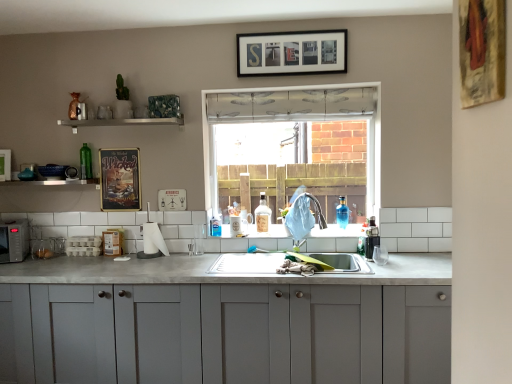
The image size is (512, 384). In order to click on metallic poster at upper left, marked as the 3th picture frame in a right-to-left arrangement in this screenshot , I will do `click(120, 179)`.

The image size is (512, 384). What do you see at coordinates (280, 334) in the screenshot?
I see `matte gray cabinets at center` at bounding box center [280, 334].

Describe the element at coordinates (342, 213) in the screenshot. The height and width of the screenshot is (384, 512). I see `blue glass bottle at sink, which appears as the third bottle when viewed from the left` at that location.

What is the approximate height of black matte microwave at left?

The height of black matte microwave at left is 10.27 inches.

Identify the location of metallic poster at upper left, the 1th picture frame positioned from the bottom. This screenshot has height=384, width=512. (120, 179).

From the picture: Measure the distance between black matte microwave at left and clear glass bottle at sink, the 2th bottle in the right-to-left sequence.

They are 5.21 feet apart.

Is black matte microwave at left far from clear glass bottle at sink, the second bottle in the left-to-right sequence?

Yes, black matte microwave at left and clear glass bottle at sink, the second bottle in the left-to-right sequence, are quite far apart.

From the image's perspective, would you say black matte microwave at left is shown under clear glass bottle at sink, the 2th bottle in the right-to-left sequence?

Indeed, from the image's perspective, black matte microwave at left is shown beneath clear glass bottle at sink, the 2th bottle in the right-to-left sequence.

Which is nearer, (11, 225) or (255, 215)?

Point (11, 225) is positioned closer to the camera compared to point (255, 215).

From a real-world perspective, is white tile at lower center, which appears as the first window sill when viewed from the left, physically below wooden framed artwork at upper right, which is the second picture frame from top to bottom?

Indeed, from a real-world perspective, white tile at lower center, which appears as the first window sill when viewed from the left, is positioned beneath wooden framed artwork at upper right, which is the second picture frame from top to bottom.

Which of these two, white tile at lower center, which appears as the first window sill when viewed from the left, or wooden framed artwork at upper right, placed as the 3th picture frame when sorted from left to right, is wider?

Wider between the two is white tile at lower center, which appears as the first window sill when viewed from the left.

Is white tile at lower center, which is counted as the first window sill, starting from the bottom, bigger than wooden framed artwork at upper right, arranged as the 3th picture frame when viewed from the back?

Yes.

You are a GUI agent. You are given a task and a screenshot of the screen. Output one action in this format:
    pyautogui.click(x=<x>, y=<y>)
    Task: Click on the 2nd window sill to the left when counting from the wooden framed artwork at upper right, arranged as the 3th picture frame when viewed from the back
    This screenshot has height=384, width=512.
    Given the screenshot: What is the action you would take?
    pyautogui.click(x=51, y=182)

From a real-world perspective, between black matte microwave at left and wooden framed artwork at upper right, which appears as the first picture frame when viewed from the right, who is vertically higher?

In real-world perspective, wooden framed artwork at upper right, which appears as the first picture frame when viewed from the right, is above.

Does black matte microwave at left contain wooden framed artwork at upper right, the second picture frame from the bottom?

No.

Image resolution: width=512 pixels, height=384 pixels. There is a black matte microwave at left. Find the location of `the 2nd picture frame above it (from the image's perspective)`. the 2nd picture frame above it (from the image's perspective) is located at coordinates (482, 51).

Is blue glass bottle at sink, which appears as the third bottle when viewed from the left, oriented away from white tile at lower center, which is the 2th window sill from right to left?

No, blue glass bottle at sink, which appears as the third bottle when viewed from the left, is not facing the opposite direction of white tile at lower center, which is the 2th window sill from right to left.

From the white tile at lower center, which is counted as the first window sill, starting from the bottom, count 3rd bottle to the right and point to it. Please provide its 2D coordinates.

[(342, 213)]

In the image, is blue glass bottle at sink, which appears as the third bottle when viewed from the left, on the left side or the right side of white tile at lower center, which is the 2th window sill from right to left?

From the image, it's evident that blue glass bottle at sink, which appears as the third bottle when viewed from the left, is to the right of white tile at lower center, which is the 2th window sill from right to left.

From a real-world perspective, between white glossy shelf at upper center, which is the first window sill in right-to-left order, and black matte picture frame at upper center, positioned as the 2th picture frame in back-to-front order, who is vertically higher?

black matte picture frame at upper center, positioned as the 2th picture frame in back-to-front order, from a real-world perspective.

Is white glossy shelf at upper center, which is counted as the 2th window sill, starting from the bottom, bigger than black matte picture frame at upper center, positioned as the 2th picture frame in back-to-front order?

Incorrect, white glossy shelf at upper center, which is counted as the 2th window sill, starting from the bottom, is not larger than black matte picture frame at upper center, positioned as the 2th picture frame in back-to-front order.

This screenshot has width=512, height=384. What are the coordinates of `window sill that is the 1st one when counting backward from the black matte picture frame at upper center, which appears as the 3th picture frame when ordered from the bottom` in the screenshot? It's located at (122, 122).

Can you confirm if white glossy shelf at upper center, which is counted as the 2th window sill, starting from the bottom, is taller than black matte picture frame at upper center, which appears as the 3th picture frame when ordered from the bottom?

Incorrect, the height of white glossy shelf at upper center, which is counted as the 2th window sill, starting from the bottom, is not larger of that of black matte picture frame at upper center, which appears as the 3th picture frame when ordered from the bottom.

Which object is further away from the camera taking this photo, white glossy shelf at upper center, which is counted as the 2th window sill, starting from the bottom, or white tile at lower center, which is the 2th window sill from right to left?

Positioned behind is white tile at lower center, which is the 2th window sill from right to left.

The height and width of the screenshot is (384, 512). Identify the location of window sill below the white glossy shelf at upper center, which ranks as the first window sill in top-to-bottom order (from a real-world perspective). (51, 182).

From a real-world perspective, is white glossy shelf at upper center, which ranks as the first window sill in top-to-bottom order, on white tile at lower center, which ranks as the 2th window sill in top-to-bottom order?

Yes, from a real-world perspective, white glossy shelf at upper center, which ranks as the first window sill in top-to-bottom order, is over white tile at lower center, which ranks as the 2th window sill in top-to-bottom order

Is white glossy shelf at upper center, positioned as the 2th window sill in left-to-right order, taller or shorter than white tile at lower center, which appears as the first window sill when viewed from the left?

In the image, white glossy shelf at upper center, positioned as the 2th window sill in left-to-right order, appears to be shorter than white tile at lower center, which appears as the first window sill when viewed from the left.

Does point (84, 163) come in front of point (261, 209)?

No, it is not.

Between green glass bottle at upper left, acting as the third bottle starting from the right, and clear glass bottle at sink, the 2th bottle in the right-to-left sequence, which one appears on the right side from the viewer's perspective?

clear glass bottle at sink, the 2th bottle in the right-to-left sequence.

Between green glass bottle at upper left, which is counted as the first bottle, starting from the left, and clear glass bottle at sink, the second bottle in the left-to-right sequence, which one has smaller width?

green glass bottle at upper left, which is counted as the first bottle, starting from the left, is thinner.

How many degrees apart are the facing directions of green glass bottle at upper left, acting as the third bottle starting from the right, and clear glass bottle at sink, the 2th bottle in the right-to-left sequence?

They differ by 0.498 degrees in their facing directions.

Locate an element on the screen. The width and height of the screenshot is (512, 384). appliance that is below the clear glass bottle at sink, the second bottle in the left-to-right sequence (from the image's perspective) is located at coordinates 14,241.

In order to click on the 2nd picture frame positioned above the white tile at lower center, which is counted as the first window sill, starting from the bottom (from the image's perspective) in this screenshot , I will do `click(482, 51)`.

Estimate the real-world distances between objects in this image. Which object is further from clear glass bottle at sink, the 2th bottle in the right-to-left sequence, satin silver faucet at sink center or matte gray cabinets at center?

The object further to clear glass bottle at sink, the 2th bottle in the right-to-left sequence, is matte gray cabinets at center.

Looking at the image, which one is located further to green glass bottle at upper left, which is counted as the first bottle, starting from the left, black matte microwave at left or matte gray cabinets at center?

matte gray cabinets at center is further to green glass bottle at upper left, which is counted as the first bottle, starting from the left.

Estimate the real-world distances between objects in this image. Which object is further from matte gray cabinets at center, wooden framed artwork at upper right, arranged as the 3th picture frame when viewed from the back, or metallic poster at upper left, the third picture frame viewed from the top?

wooden framed artwork at upper right, arranged as the 3th picture frame when viewed from the back.

Considering their positions, is transparent plastic window at center positioned further to black matte picture frame at upper center, the 2th picture frame positioned from the front, than white tile at lower center, which is the 2th window sill from right to left?

Based on the image, white tile at lower center, which is the 2th window sill from right to left, appears to be further to black matte picture frame at upper center, the 2th picture frame positioned from the front.

Based on their spatial positions, is black matte picture frame at upper center, which appears as the 3th picture frame when ordered from the bottom, or metallic poster at upper left, marked as the 3th picture frame in a right-to-left arrangement, closer to white glossy shelf at upper center, which is counted as the 2th window sill, starting from the bottom?

metallic poster at upper left, marked as the 3th picture frame in a right-to-left arrangement, is positioned closer to the anchor white glossy shelf at upper center, which is counted as the 2th window sill, starting from the bottom.

From the picture: Looking at the image, which one is located further to satin silver faucet at sink center, matte gray cabinets at center or wooden framed artwork at upper right, the 1th picture frame positioned from the front?

Based on the image, wooden framed artwork at upper right, the 1th picture frame positioned from the front, appears to be further to satin silver faucet at sink center.

Based on their spatial positions, is white glossy shelf at upper center, which is counted as the 2th window sill, starting from the bottom, or blue glass bottle at sink, which appears as the 1th bottle when viewed from the right, closer to transparent plastic window at center?

Among the two, blue glass bottle at sink, which appears as the 1th bottle when viewed from the right, is located nearer to transparent plastic window at center.

Estimate the real-world distances between objects in this image. Which object is closer to matte gray cabinets at center, transparent plastic window at center or black matte microwave at left?

Based on the image, transparent plastic window at center appears to be nearer to matte gray cabinets at center.

Locate an element on the screen. cabinetry located between wooden framed artwork at upper right, which appears as the first picture frame when viewed from the right, and satin silver faucet at sink center in the depth direction is located at coordinates (280, 334).

Find the location of `faucet between wooden framed artwork at upper right, which is the second picture frame from top to bottom, and black matte picture frame at upper center, positioned as the 2th picture frame in back-to-front order, in the front-back direction`. faucet between wooden framed artwork at upper right, which is the second picture frame from top to bottom, and black matte picture frame at upper center, positioned as the 2th picture frame in back-to-front order, in the front-back direction is located at coordinates (303, 217).

You are a GUI agent. You are given a task and a screenshot of the screen. Output one action in this format:
    pyautogui.click(x=<x>, y=<y>)
    Task: Click on the window situated between black matte microwave at left and blue glass bottle at sink, which appears as the third bottle when viewed from the left, from left to right
    Image resolution: width=512 pixels, height=384 pixels.
    Given the screenshot: What is the action you would take?
    pyautogui.click(x=302, y=90)

Where is `cabinetry between wooden framed artwork at upper right, which appears as the first picture frame when viewed from the right, and white tile at lower center, which appears as the first window sill when viewed from the left, in the front-back direction`? The image size is (512, 384). cabinetry between wooden framed artwork at upper right, which appears as the first picture frame when viewed from the right, and white tile at lower center, which appears as the first window sill when viewed from the left, in the front-back direction is located at coordinates (280, 334).